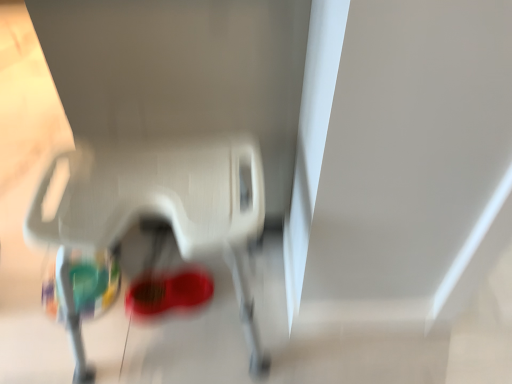
What do you see at coordinates (168, 292) in the screenshot? The height and width of the screenshot is (384, 512). I see `shiny red shoe at center` at bounding box center [168, 292].

Image resolution: width=512 pixels, height=384 pixels. I want to click on shiny red shoe at center, so [168, 292].

Describe the element at coordinates (164, 205) in the screenshot. I see `white plastic baby carriage at lower center` at that location.

In order to face white plastic baby carriage at lower center, should I rotate leftwards or rightwards?

A 12.135 degree turn to the left will do.

The image size is (512, 384). I want to click on white plastic baby carriage at lower center, so click(x=164, y=205).

Identify the location of shiny red shoe at center. (168, 292).

Is white plastic baby carriage at lower center to the right of shiny red shoe at center from the viewer's perspective?

Yes.

Which object is further away from the camera taking this photo, white plastic baby carriage at lower center or shiny red shoe at center?

shiny red shoe at center is further away from the camera.

Is point (211, 138) positioned in front of point (170, 279)?

Yes, it is in front of point (170, 279).

From the image's perspective, is white plastic baby carriage at lower center located above shiny red shoe at center?

Indeed, from the image's perspective, white plastic baby carriage at lower center is shown above shiny red shoe at center.

From a real-world perspective, relative to shiny red shoe at center, is white plastic baby carriage at lower center vertically above or below?

From a real-world perspective, white plastic baby carriage at lower center is physically above shiny red shoe at center.

Does white plastic baby carriage at lower center have a greater width compared to shiny red shoe at center?

Yes, white plastic baby carriage at lower center is wider than shiny red shoe at center.

Can you confirm if white plastic baby carriage at lower center is shorter than shiny red shoe at center?

No.

Considering the sizes of objects white plastic baby carriage at lower center and shiny red shoe at center in the image provided, who is bigger, white plastic baby carriage at lower center or shiny red shoe at center?

white plastic baby carriage at lower center is bigger.

Can we say white plastic baby carriage at lower center lies outside shiny red shoe at center?

Indeed, white plastic baby carriage at lower center is completely outside shiny red shoe at center.

Is white plastic baby carriage at lower center far from shiny red shoe at center?

No, white plastic baby carriage at lower center is in close proximity to shiny red shoe at center.

Is white plastic baby carriage at lower center positioned with its back to shiny red shoe at center?

white plastic baby carriage at lower center does not have its back to shiny red shoe at center.

How many degrees apart are the facing directions of white plastic baby carriage at lower center and shiny red shoe at center?

There is a 169-degree angle between the facing directions of white plastic baby carriage at lower center and shiny red shoe at center.

This screenshot has height=384, width=512. I want to click on baby carriage above the shiny red shoe at center (from the image's perspective), so click(164, 205).

Considering the positions of objects shiny red shoe at center and white plastic baby carriage at lower center in the image provided, who is more to the right, shiny red shoe at center or white plastic baby carriage at lower center?

white plastic baby carriage at lower center.

Considering their positions, is shiny red shoe at center located in front of or behind white plastic baby carriage at lower center?

shiny red shoe at center is positioned farther from the viewer than white plastic baby carriage at lower center.

Does point (153, 311) lie in front of point (248, 344)?

No.

From the image's perspective, who appears lower, shiny red shoe at center or white plastic baby carriage at lower center?

From the image's view, shiny red shoe at center is below.

From a real-world perspective, is shiny red shoe at center over white plastic baby carriage at lower center?

No, from a real-world perspective, shiny red shoe at center is not on top of white plastic baby carriage at lower center.

Is shiny red shoe at center wider or thinner than white plastic baby carriage at lower center?

Considering their sizes, shiny red shoe at center looks slimmer than white plastic baby carriage at lower center.

Does shiny red shoe at center have a lesser height compared to white plastic baby carriage at lower center?

Correct, shiny red shoe at center is not as tall as white plastic baby carriage at lower center.

From the picture: Which of these two, shiny red shoe at center or white plastic baby carriage at lower center, is smaller?

With smaller size is shiny red shoe at center.

Looking at this image, is shiny red shoe at center not within white plastic baby carriage at lower center?

No.

Is the surface of shiny red shoe at center in direct contact with white plastic baby carriage at lower center?

shiny red shoe at center is not next to white plastic baby carriage at lower center, and they're not touching.

Is shiny red shoe at center looking in the opposite direction of white plastic baby carriage at lower center?

Absolutely, shiny red shoe at center is directed away from white plastic baby carriage at lower center.

How many degrees apart are the facing directions of shiny red shoe at center and white plastic baby carriage at lower center?

They differ by 169 degrees in their facing directions.

The image size is (512, 384). In order to click on footwear on the left side of white plastic baby carriage at lower center in this screenshot , I will do `click(168, 292)`.

Locate an element on the screen. This screenshot has width=512, height=384. baby carriage that appears in front of the shiny red shoe at center is located at coordinates (164, 205).

This screenshot has width=512, height=384. What are the coordinates of `baby carriage that is above the shiny red shoe at center (from a real-world perspective)` in the screenshot? It's located at 164,205.